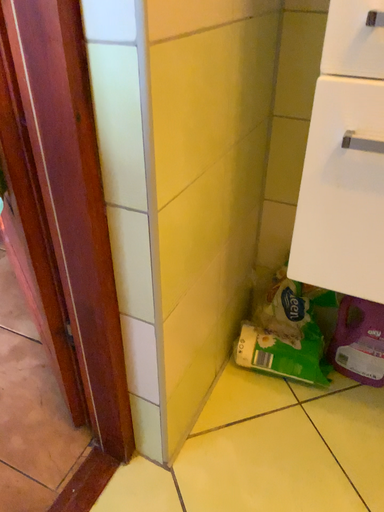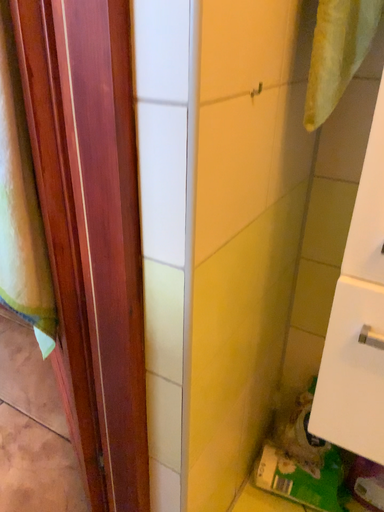
Question: How did the camera likely rotate when shooting the video?

Choices:
 (A) rotated upward
 (B) rotated downward

Answer: (A)